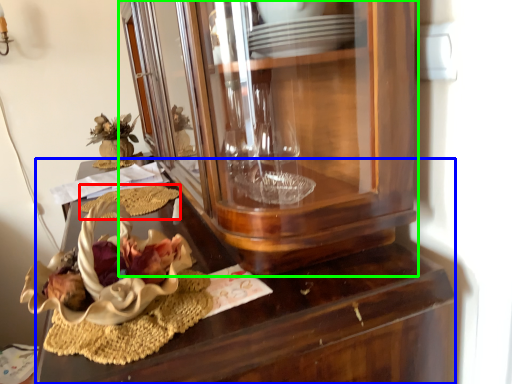
Question: Which object is positioned farthest from food (highlighted by a red box)? Select from desk (highlighted by a blue box) and cabinetry (highlighted by a green box).

Choices:
 (A) desk
 (B) cabinetry

Answer: (B)